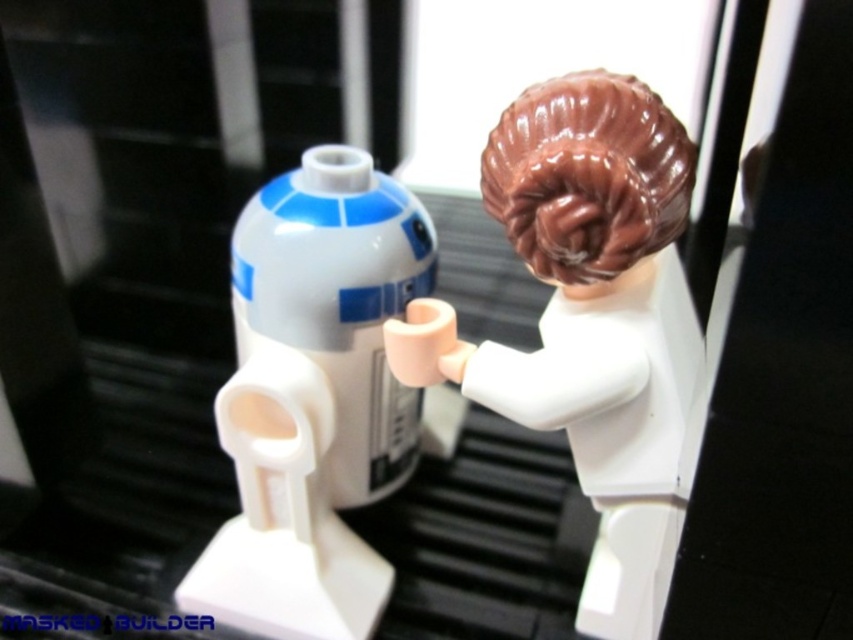
Question: Can you confirm if brown glossy hair at upper center is positioned to the right of white plastic r2-d2 at center?

Choices:
 (A) no
 (B) yes

Answer: (B)

Question: From the image, what is the correct spatial relationship of brown glossy hair at upper center in relation to white plastic r2-d2 at center?

Choices:
 (A) above
 (B) below

Answer: (A)

Question: Is brown glossy hair at upper center positioned before white plastic r2-d2 at center?

Choices:
 (A) yes
 (B) no

Answer: (A)

Question: Among these objects, which one is farthest from the camera?

Choices:
 (A) white plastic r2-d2 at center
 (B) brown glossy hair at upper center

Answer: (A)